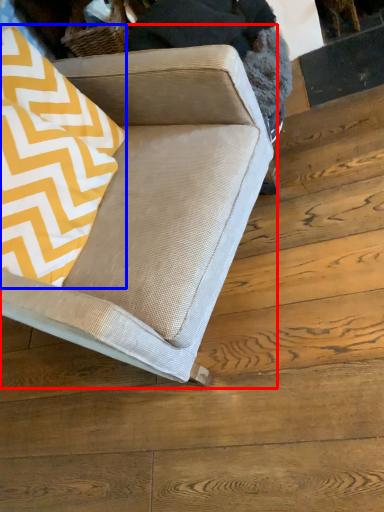
Question: Which of the following is the closest to the observer, studio couch (highlighted by a red box) or throw pillow (highlighted by a blue box)?

Choices:
 (A) studio couch
 (B) throw pillow

Answer: (A)